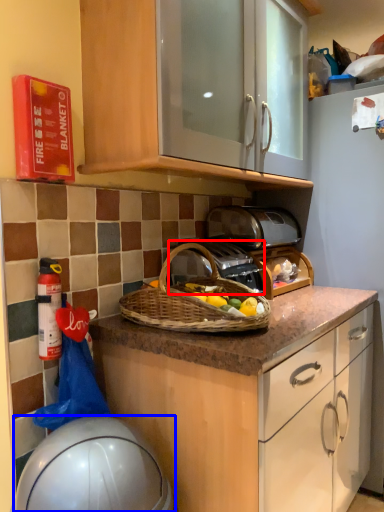
Question: Which object is further to the camera taking this photo, gas stove (highlighted by a red box) or appliance (highlighted by a blue box)?

Choices:
 (A) gas stove
 (B) appliance

Answer: (A)